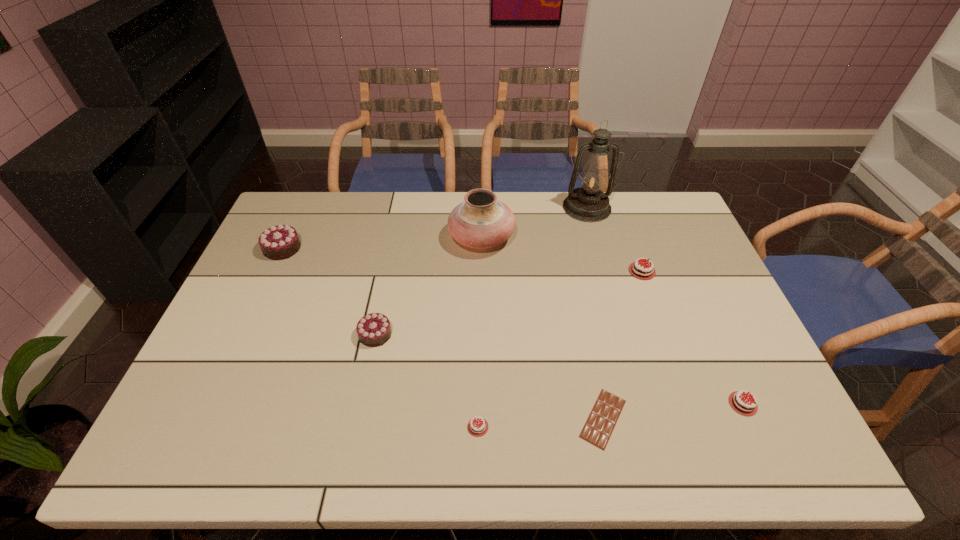
Where is `blank region between the fourth nearest object and the third shortest chocolate cake`? The width and height of the screenshot is (960, 540). blank region between the fourth nearest object and the third shortest chocolate cake is located at coordinates (509, 303).

Find the location of a particular element. unoccupied area between the oil lamp and the bigger chocolate chocolate cake is located at coordinates (435, 228).

Locate an element on the screen. The image size is (960, 540). object that is the fourth closest to the pottery is located at coordinates (604, 415).

Where is `object identified as the sixth closest to the biggest red chocolate cake`? object identified as the sixth closest to the biggest red chocolate cake is located at coordinates (374, 329).

The height and width of the screenshot is (540, 960). In order to click on the second closest chocolate cake relative to the smaller chocolate chocolate cake in this screenshot , I will do `click(279, 242)`.

Locate which chocolate cake ranks in proximity to the tallest object. Please provide its 2D coordinates. Your answer should be formatted as a tuple, i.e. [(x, y)], where the tuple contains the x and y coordinates of a point satisfying the conditions above.

[(640, 271)]

Where is `red chocolate cake that is the second closest to the tallest object`? This screenshot has width=960, height=540. red chocolate cake that is the second closest to the tallest object is located at coordinates (741, 404).

Locate which red chocolate cake is the closest to the tallest chocolate cake. Please provide its 2D coordinates. Your answer should be formatted as a tuple, i.e. [(x, y)], where the tuple contains the x and y coordinates of a point satisfying the conditions above.

[(477, 427)]

At what (x,y) coordinates should I click in order to perform the action: click on vacant space that satisfies the following two spatial constraints: 1. on the front side of the oil lamp; 2. on the right side of the third shortest object. Please return your answer as a coordinate pair (x, y). This screenshot has height=540, width=960. Looking at the image, I should click on (641, 404).

This screenshot has width=960, height=540. I want to click on free space that satisfies the following two spatial constraints: 1. on the back side of the brown chocolate bar; 2. on the left side of the fourth tallest chocolate cake, so click(600, 404).